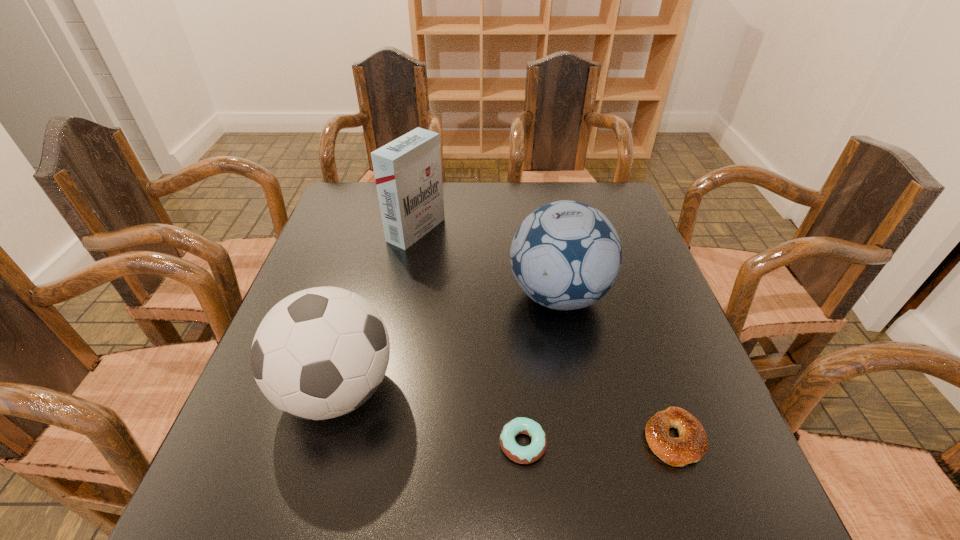
This screenshot has width=960, height=540. I want to click on vacant region between the shortest object and the bagel, so click(598, 441).

This screenshot has height=540, width=960. Identify the location of object that is the second closest one to the left soccer ball. (566, 255).

Locate an element on the screen. The image size is (960, 540). object that can be found as the fourth closest to the nearer soccer ball is located at coordinates (692, 443).

Find the location of a particular element. Image resolution: width=960 pixels, height=540 pixels. vacant area that satisfies the following two spatial constraints: 1. on the back side of the nearer soccer ball; 2. on the right side of the farthest object is located at coordinates (382, 230).

Where is `vacant region that satisfies the following two spatial constraints: 1. on the side with brand of the fourth tallest object; 2. on the left side of the farther soccer ball`? vacant region that satisfies the following two spatial constraints: 1. on the side with brand of the fourth tallest object; 2. on the left side of the farther soccer ball is located at coordinates (586, 438).

This screenshot has height=540, width=960. Identify the location of vacant space that satisfies the following two spatial constraints: 1. on the front side of the left soccer ball; 2. on the left side of the shortest object. (323, 444).